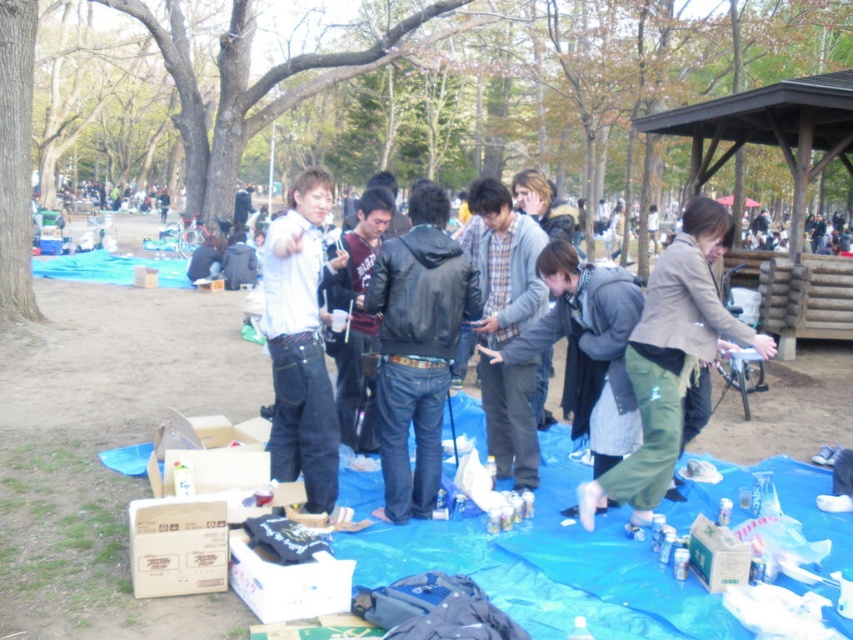
Between matte brown jacket at center and white matte jacket at center, which one has less height?

With less height is matte brown jacket at center.

How much distance is there between matte brown jacket at center and white matte jacket at center?

matte brown jacket at center and white matte jacket at center are 1.73 meters apart.

Who is more forward, (665, 324) or (305, 264)?

Point (305, 264) is more forward.

At what (x,y) coordinates should I click in order to perform the action: click on matte brown jacket at center. Please return your answer as a coordinate pair (x, y). Image resolution: width=853 pixels, height=640 pixels. Looking at the image, I should click on (670, 360).

Which is more to the right, black leather jacket at center or matte brown jacket at center?

matte brown jacket at center

Does black leather jacket at center come behind matte brown jacket at center?

Yes, black leather jacket at center is further from the viewer.

The width and height of the screenshot is (853, 640). Identify the location of black leather jacket at center. (416, 348).

Is black leather jacket at center bigger than white matte jacket at center?

Correct, black leather jacket at center is larger in size than white matte jacket at center.

The image size is (853, 640). What do you see at coordinates (416, 348) in the screenshot?
I see `black leather jacket at center` at bounding box center [416, 348].

Image resolution: width=853 pixels, height=640 pixels. Describe the element at coordinates (416, 348) in the screenshot. I see `black leather jacket at center` at that location.

Identify the location of black leather jacket at center. This screenshot has width=853, height=640. (416, 348).